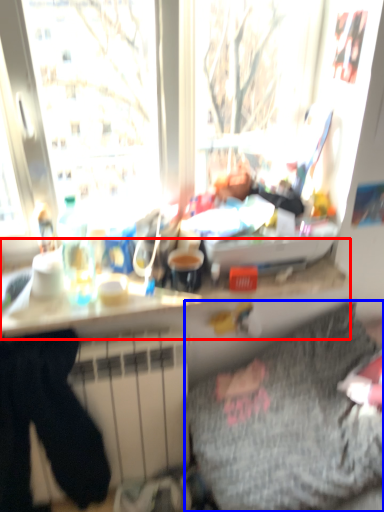
Question: Which object appears closest to the camera in this image, counter top (highlighted by a red box) or bedding (highlighted by a blue box)?

Choices:
 (A) counter top
 (B) bedding

Answer: (B)